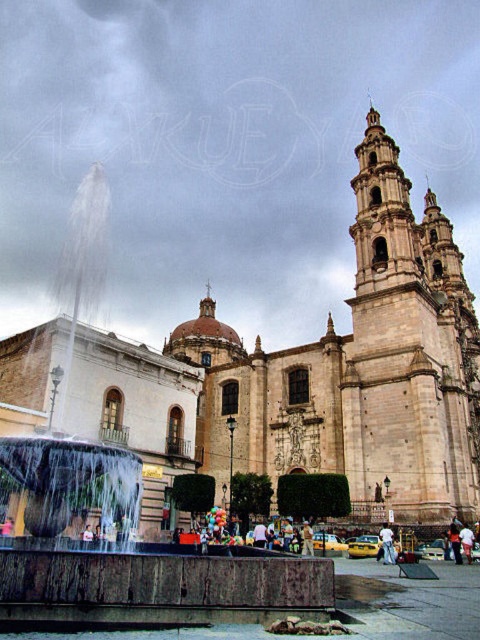
Is beige stone church at center to the left of light blue jeans at center from the viewer's perspective?

Correct, you'll find beige stone church at center to the left of light blue jeans at center.

Is point (462, 356) in front of point (384, 534)?

No, it is behind (384, 534).

What do you see at coordinates (359, 369) in the screenshot?
I see `beige stone church at center` at bounding box center [359, 369].

Image resolution: width=480 pixels, height=640 pixels. Identify the location of beige stone church at center. (359, 369).